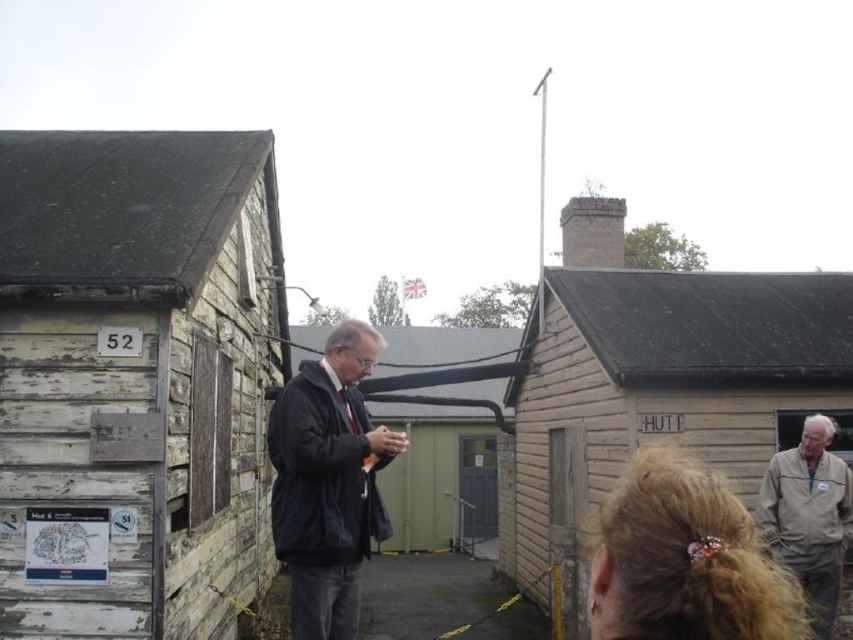
Can you confirm if tan fabric jacket at lower right is positioned to the left of brick chimney at upper center?

In fact, tan fabric jacket at lower right is to the right of brick chimney at upper center.

Can you confirm if tan fabric jacket at lower right is thinner than brick chimney at upper center?

Yes.

Does point (769, 467) come farther from viewer compared to point (618, 202)?

No, (769, 467) is closer to viewer.

You are a GUI agent. You are given a task and a screenshot of the screen. Output one action in this format:
    pyautogui.click(x=<x>, y=<y>)
    Task: Click on the tan fabric jacket at lower right
    This screenshot has width=853, height=640.
    Given the screenshot: What is the action you would take?
    pyautogui.click(x=809, y=516)

Does weathered wood hut at left have a lesser width compared to wooden hut at right?

Indeed, weathered wood hut at left has a lesser width compared to wooden hut at right.

Which is below, weathered wood hut at left or wooden hut at right?

Positioned lower is wooden hut at right.

Who is more distant from viewer, (228,406) or (843,381)?

Point (843,381)

Locate an element on the screen. Image resolution: width=853 pixels, height=640 pixels. weathered wood hut at left is located at coordinates (134, 376).

Can you confirm if dark blue jacket at center is thinner than brick chimney at upper center?

Indeed, dark blue jacket at center has a lesser width compared to brick chimney at upper center.

Who is higher up, dark blue jacket at center or brick chimney at upper center?

brick chimney at upper center is above.

From the picture: Who is more forward, (271,432) or (567,204)?

Point (271,432) is in front.

Identify the location of dark blue jacket at center. (328, 483).